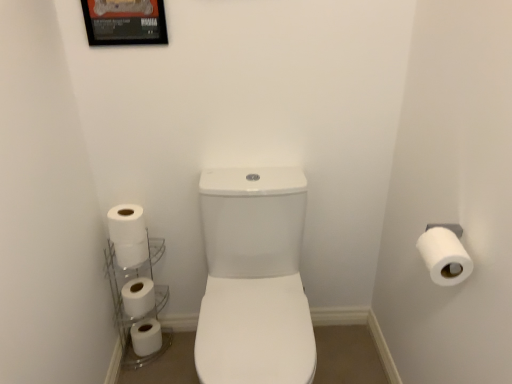
Find the location of a particular element. The image size is (512, 384). vacant area that is in front of white matte toilet paper at lower left, which is the first toilet paper in back-to-front order is located at coordinates tap(150, 366).